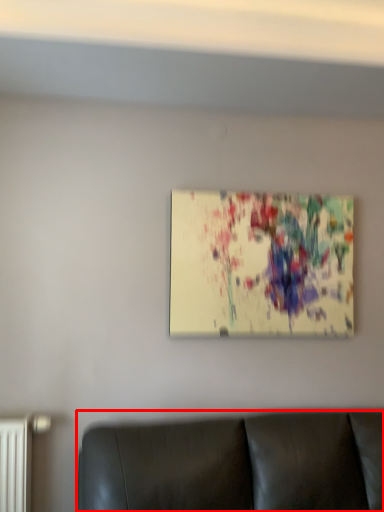
Question: In this image, where is furniture (annotated by the red box) located relative to picture frame?

Choices:
 (A) left
 (B) right

Answer: (A)